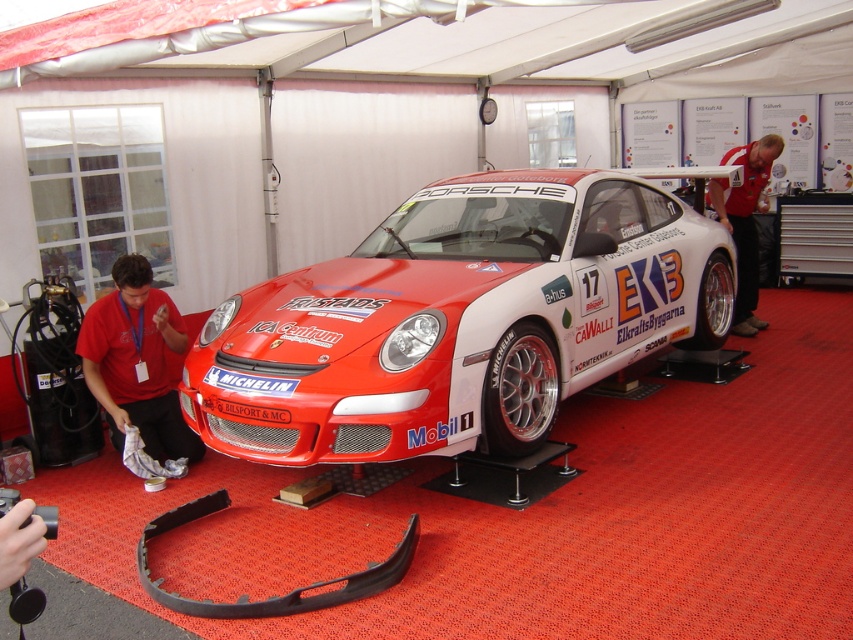
Question: Where is shiny red racing car at center located in relation to red fabric shirt at upper right in the image?

Choices:
 (A) above
 (B) below

Answer: (B)

Question: Does shiny red racing car at center come behind matte red shirt at lower left?

Choices:
 (A) yes
 (B) no

Answer: (B)

Question: Estimate the real-world distances between objects in this image. Which object is closer to the red fabric shirt at upper right?

Choices:
 (A) shiny red racing car at center
 (B) matte red shirt at lower left

Answer: (A)

Question: Is shiny red racing car at center in front of matte red shirt at lower left?

Choices:
 (A) no
 (B) yes

Answer: (B)

Question: Based on their relative distances, which object is farther from the shiny red racing car at center?

Choices:
 (A) red fabric shirt at upper right
 (B) matte red shirt at lower left

Answer: (A)

Question: Among these objects, which one is nearest to the camera?

Choices:
 (A) shiny red racing car at center
 (B) matte red shirt at lower left
 (C) red fabric shirt at upper right

Answer: (A)